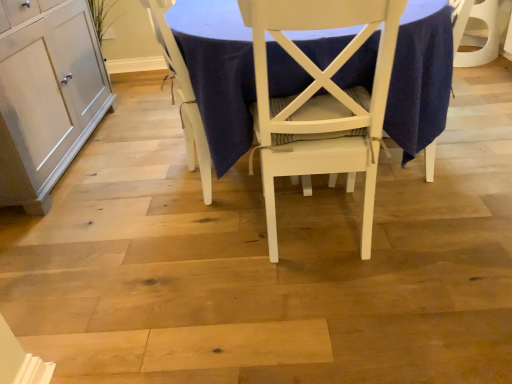
Question: Is matte white cabinet at left completely or partially outside of white wood table at center?

Choices:
 (A) no
 (B) yes

Answer: (B)

Question: From the image's perspective, does matte white cabinet at left appear higher than white wood table at center?

Choices:
 (A) no
 (B) yes

Answer: (A)

Question: Can you confirm if matte white cabinet at left is thinner than white wood table at center?

Choices:
 (A) no
 (B) yes

Answer: (B)

Question: Considering the relative sizes of matte white cabinet at left and white wood table at center in the image provided, is matte white cabinet at left shorter than white wood table at center?

Choices:
 (A) yes
 (B) no

Answer: (B)

Question: Does matte white cabinet at left have a smaller size compared to white wood table at center?

Choices:
 (A) no
 (B) yes

Answer: (B)

Question: Considering the positions of white wood table at center and matte white cabinet at left in the image, is white wood table at center wider or thinner than matte white cabinet at left?

Choices:
 (A) wide
 (B) thin

Answer: (A)

Question: Considering their positions, is white wood table at center located in front of or behind matte white cabinet at left?

Choices:
 (A) front
 (B) behind

Answer: (A)

Question: Would you say white wood table at center is inside or outside matte white cabinet at left?

Choices:
 (A) outside
 (B) inside

Answer: (A)

Question: Is white wood table at center taller or shorter than matte white cabinet at left?

Choices:
 (A) tall
 (B) short

Answer: (B)

Question: In the image, is matte white cabinet at left positioned in front of or behind white wood table at center?

Choices:
 (A) behind
 (B) front

Answer: (A)

Question: Looking at the image, does matte white cabinet at left seem bigger or smaller compared to white wood table at center?

Choices:
 (A) small
 (B) big

Answer: (A)

Question: Is point (8, 172) closer or farther from the camera than point (416, 109)?

Choices:
 (A) farther
 (B) closer

Answer: (A)

Question: In terms of width, does matte white cabinet at left look wider or thinner when compared to white wood table at center?

Choices:
 (A) wide
 (B) thin

Answer: (B)

Question: Considering the positions of white painted wood chair at center, the second chair in the left-to-right sequence, and white wood table at center in the image, is white painted wood chair at center, the second chair in the left-to-right sequence, wider or thinner than white wood table at center?

Choices:
 (A) wide
 (B) thin

Answer: (B)

Question: Considering the positions of white painted wood chair at center, the second chair in the left-to-right sequence, and white wood table at center in the image, is white painted wood chair at center, the second chair in the left-to-right sequence, taller or shorter than white wood table at center?

Choices:
 (A) tall
 (B) short

Answer: (A)